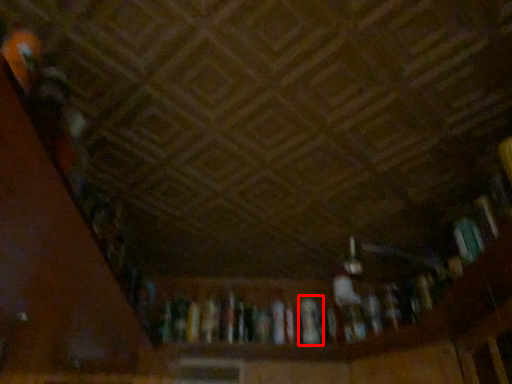
Question: From the image's perspective, where is book (annotated by the red box) located in relation to book in the image?

Choices:
 (A) above
 (B) below

Answer: (B)